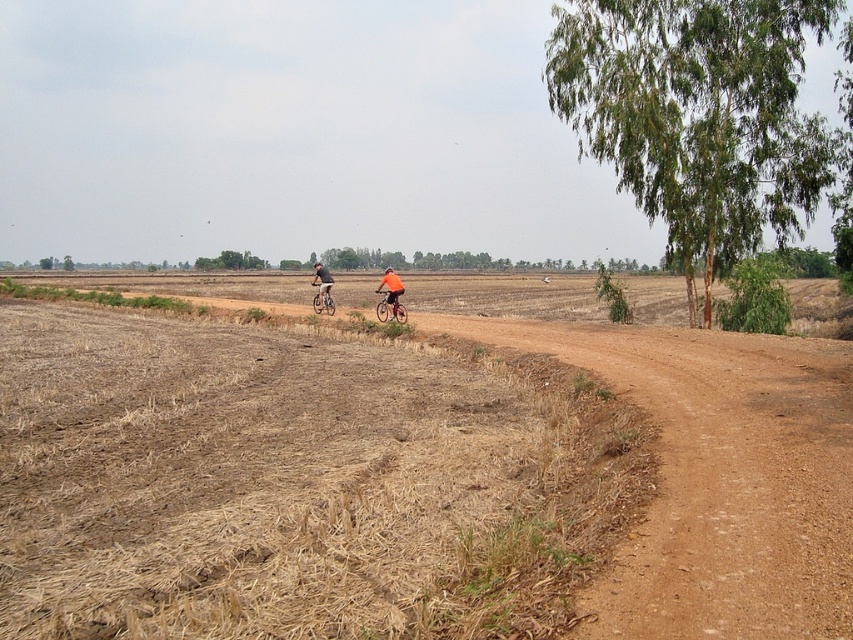
Question: Which point appears closest to the camera in this image?

Choices:
 (A) (403, 321)
 (B) (627, 77)
 (C) (312, 280)

Answer: (B)

Question: Which point appears farthest from the camera in this image?

Choices:
 (A) (323, 272)
 (B) (241, 467)
 (C) (643, 192)
 (D) (399, 292)

Answer: (A)

Question: In this image, where is brown dry grass at center located relative to silver metallic bicycle at center?

Choices:
 (A) left
 (B) right

Answer: (B)

Question: Which point is farther to the camera?

Choices:
 (A) (329, 284)
 (B) (821, 134)

Answer: (A)

Question: Is brown dry grass at center wider than orange fabric cyclist at center?

Choices:
 (A) yes
 (B) no

Answer: (A)

Question: Is brown dry grass at center to the left of green leafy tree at upper right from the viewer's perspective?

Choices:
 (A) no
 (B) yes

Answer: (B)